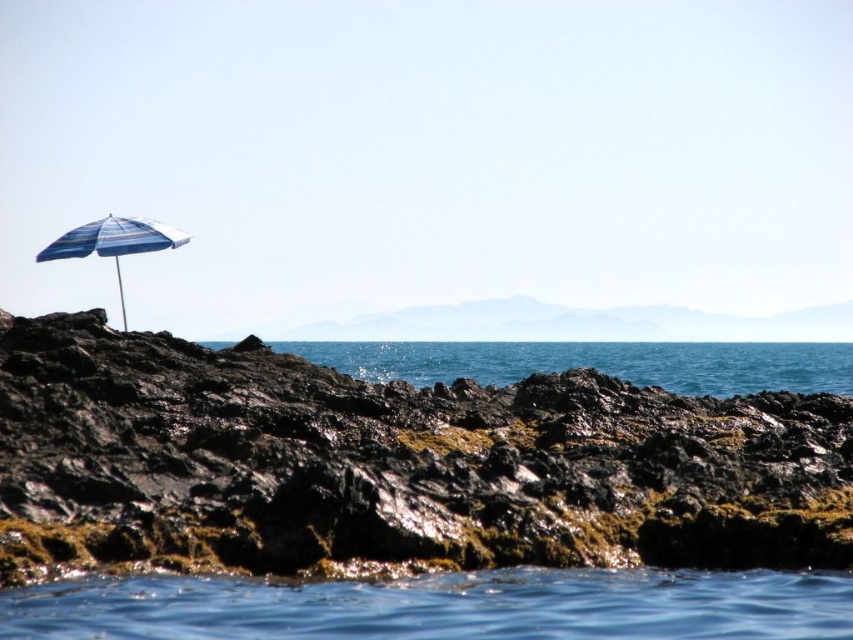
You are a photographer standing at the edge of the rocky shoreline. You notice two points marked in the scene. The first point is at coordinates point (334,346) and the second point is at point (67,250). Which point is closer to your camera?

Point (67,250) is closer to the camera because the description states that point (334,346) is further away than point (67,250).

You are a photographer planning to capture the black rock at left and the transparent blue water at lower center in your shot. Which object should you focus on first if you want to ensure both are in sharp focus, considering their sizes?

The black rock at left is larger in size than the transparent blue water at lower center, so you should focus on the larger object first to ensure both are in sharp focus.